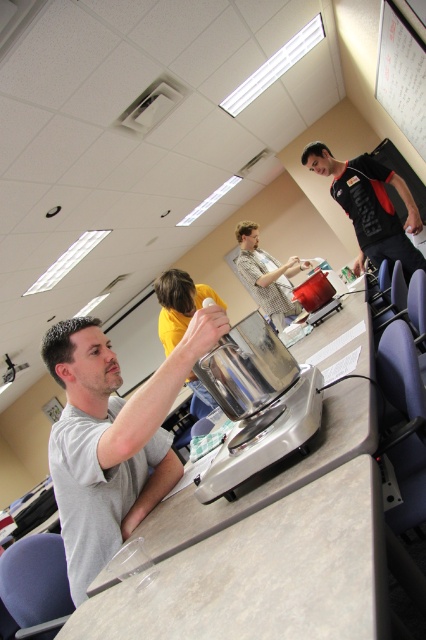
You are a student sitting at the back of the classroom and want to hand in your assignment to the teacher wearing the gray matte shirt at center. If your reach is 1.0 meters, can you hand it directly without moving from your seat?

The distance between you and the gray matte shirt at center is 1.09 meters, which is slightly longer than your reach of 1.0 meters. Therefore, you cannot hand it directly without moving closer.

You are a student in the classroom and need to place a book on the polished stainless steel food processor at center so that it can be seen from the white paperboard at upper right. Is the food processor tall enough for this purpose?

The polished stainless steel food processor at center is shorter than the white paperboard at upper right, so placing a book on it may not make it visible from the white paperboard at upper right unless the book is elevated further.